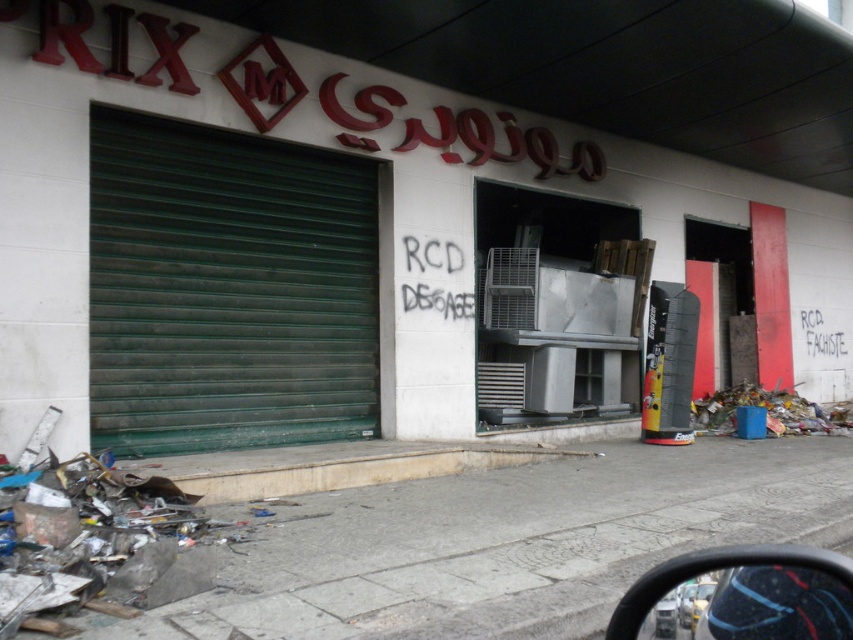
You are a delivery person trying to park your van in front of the building. The van requires a parking space that is at least as tall as the green matte garage door at left. Is the beige concrete curb at lower center an obstacle in this scenario?

The green matte garage door at left is taller than the beige concrete curb at lower center. Since the van requires a parking space at least as tall as the garage door, the curb is shorter and therefore not an obstacle in this scenario.

From the picture: You are standing in front of the building and want to walk towards the gray concrete pavement at lower center and the beige concrete curb at lower center. Which one will you step on first?

You will step on the gray concrete pavement at lower center first because it is closer to you than the beige concrete curb at lower center.